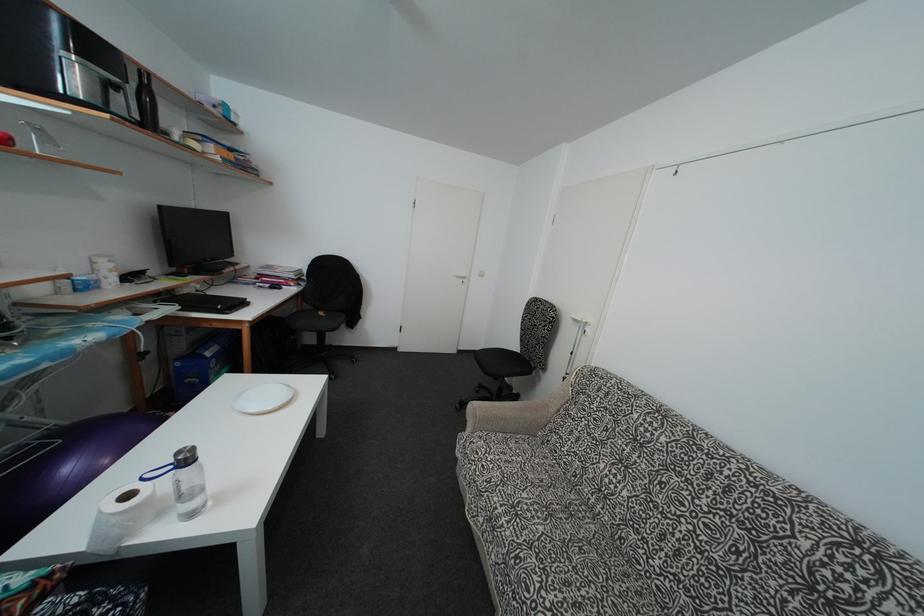
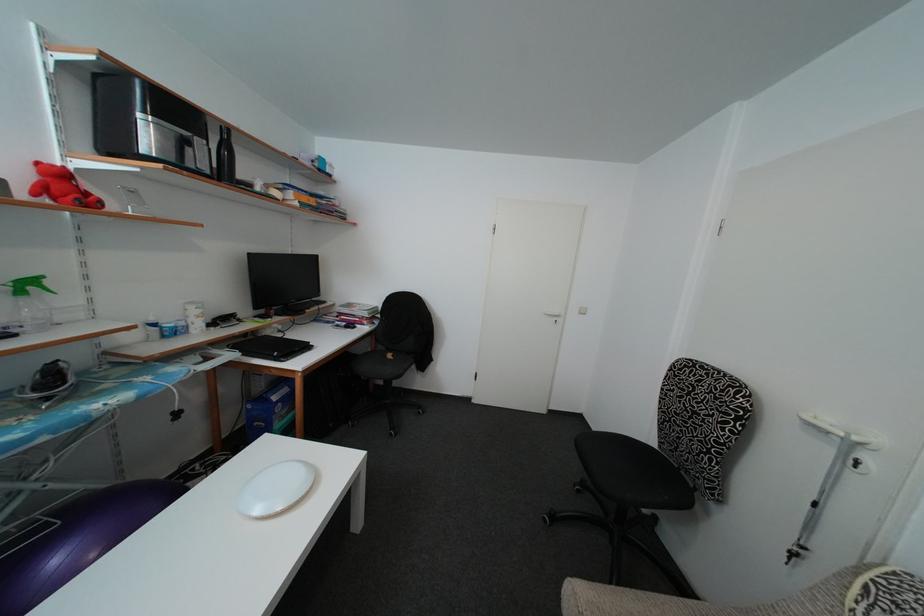
Question: Which direction would the cameraman need to move to produce the second image? Reply with the corresponding letter.

Choices:
 (A) Left
 (B) Right
 (C) Forward
 (D) Backward

Answer: (C)